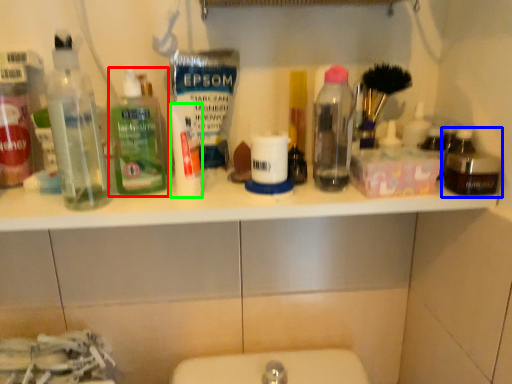
Question: Which is nearer to the bottle (highlighted by a red box)? bottle (highlighted by a blue box) or toiletry (highlighted by a green box).

Choices:
 (A) bottle
 (B) toiletry

Answer: (B)